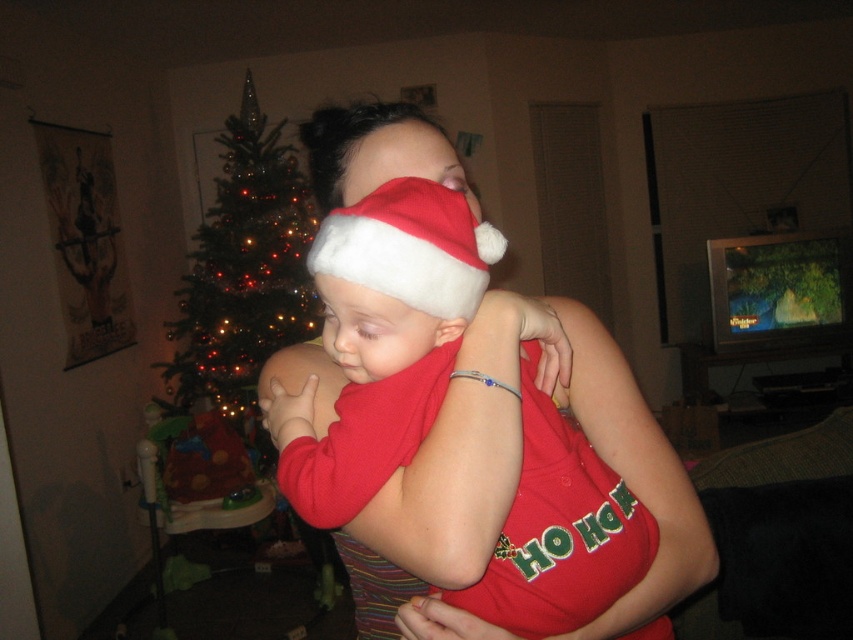
Does green artificial christmas tree at left appear on the left side of white fluffy santa hat at center?

Indeed, green artificial christmas tree at left is positioned on the left side of white fluffy santa hat at center.

Can you confirm if green artificial christmas tree at left is shorter than white fluffy santa hat at center?

Incorrect, green artificial christmas tree at left's height does not fall short of white fluffy santa hat at center's.

Where is `green artificial christmas tree at left`? green artificial christmas tree at left is located at coordinates (242, 268).

The width and height of the screenshot is (853, 640). In order to click on green artificial christmas tree at left in this screenshot , I will do `click(242, 268)`.

Is matte red santa hat at center wider than white fluffy santa hat at center?

Indeed, matte red santa hat at center has a greater width compared to white fluffy santa hat at center.

What do you see at coordinates (519, 460) in the screenshot? I see `matte red santa hat at center` at bounding box center [519, 460].

Find the location of a particular element. The width and height of the screenshot is (853, 640). matte red santa hat at center is located at coordinates (519, 460).

Can you confirm if matte red santa hat at center is smaller than green artificial christmas tree at left?

Yes.

Who is more distant from viewer, (502, 400) or (235, 362)?

Positioned behind is point (235, 362).

The height and width of the screenshot is (640, 853). What do you see at coordinates (519, 460) in the screenshot?
I see `matte red santa hat at center` at bounding box center [519, 460].

I want to click on matte red santa hat at center, so click(x=519, y=460).